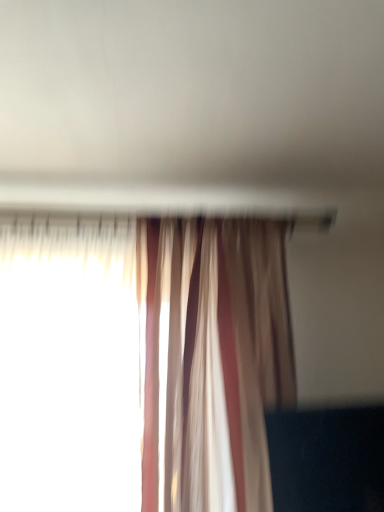
Looking at this image, measure the distance between point (x=350, y=412) and camera.

Point (x=350, y=412) is 4.02 feet from camera.

Where is `black matte tv at lower right`? black matte tv at lower right is located at coordinates (327, 459).

What do you see at coordinates (327, 459) in the screenshot? This screenshot has height=512, width=384. I see `black matte tv at lower right` at bounding box center [327, 459].

What are the coordinates of `black matte tv at lower right` in the screenshot? It's located at (327, 459).